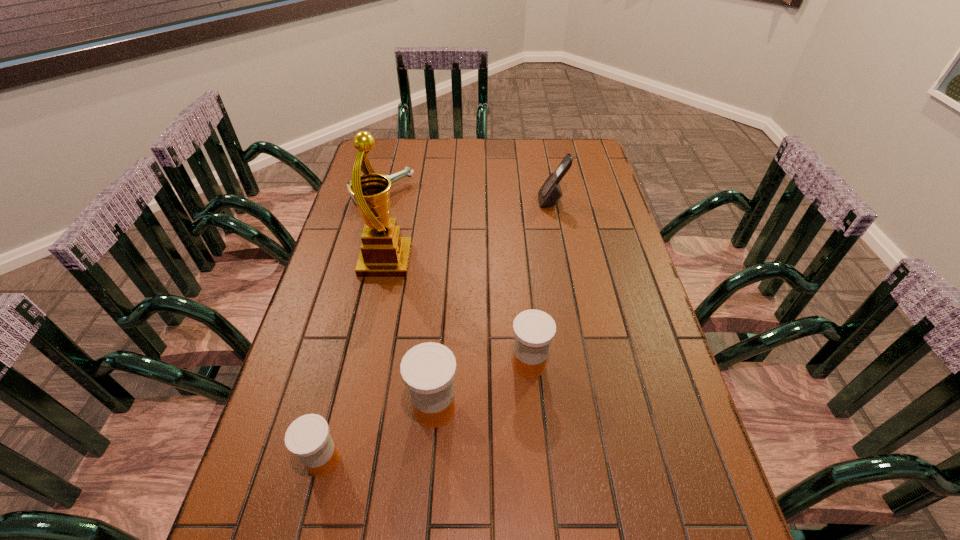
Where is `free space that is in between the rightmost medicine and the fourth nearest object`? free space that is in between the rightmost medicine and the fourth nearest object is located at coordinates (458, 313).

Locate an element on the screen. The height and width of the screenshot is (540, 960). unoccupied area between the tallest object and the rightmost object is located at coordinates (468, 231).

Choose which object is the fourth nearest neighbor to the bottle. Please provide its 2D coordinates. Your answer should be formatted as a tuple, i.e. [(x, y)], where the tuple contains the x and y coordinates of a point satisfying the conditions above.

[(428, 369)]

This screenshot has width=960, height=540. Identify the location of object that is the fourth closest to the second tallest medicine. (550, 193).

I want to click on the closest medicine relative to the rightmost object, so click(x=534, y=330).

You are a GUI agent. You are given a task and a screenshot of the screen. Output one action in this format:
    pyautogui.click(x=<x>, y=<y>)
    Task: Click on the medicine that stands as the second closest to the fifth farthest object
    The width and height of the screenshot is (960, 540).
    Given the screenshot: What is the action you would take?
    pyautogui.click(x=308, y=437)

I want to click on vacant point that satisfies the following two spatial constraints: 1. on the front-facing side of the cellular telephone; 2. on the label of the leftmost medicine, so click(x=601, y=461).

Identify the location of vacant space that satisfies the following two spatial constraints: 1. on the front-facing side of the rightmost object; 2. on the label of the leftmost medicine. The width and height of the screenshot is (960, 540). (601, 461).

Where is `free space that satisfies the following two spatial constraints: 1. on the label of the second nearest object; 2. on the label of the nearest medicine`? This screenshot has height=540, width=960. free space that satisfies the following two spatial constraints: 1. on the label of the second nearest object; 2. on the label of the nearest medicine is located at coordinates (430, 461).

At what (x,y) coordinates should I click in order to perform the action: click on vacant area in the image that satisfies the following two spatial constraints: 1. on the label of the fifth farthest object; 2. on the label of the fifth tallest object. Please return your answer as a coordinate pair (x, y). Looking at the image, I should click on (430, 461).